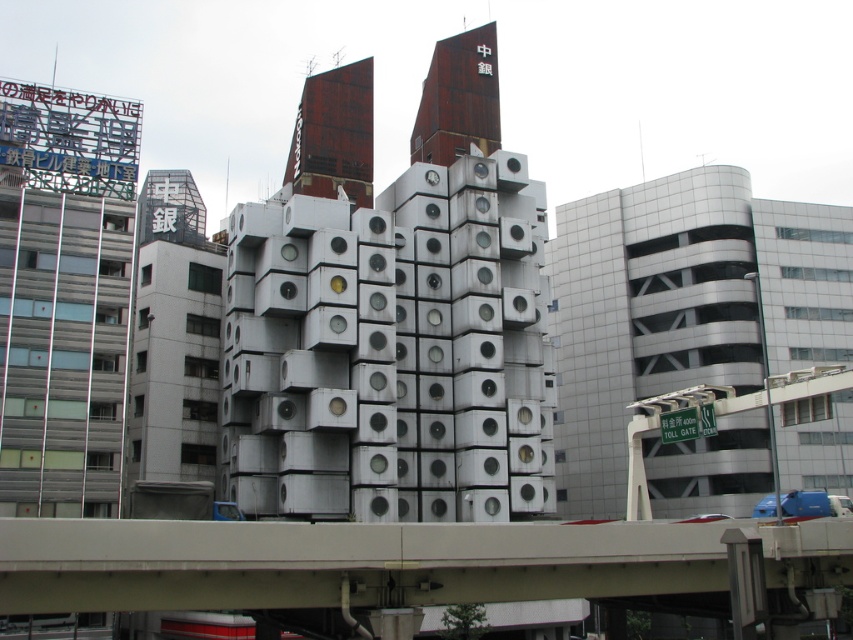
Does point (766, 545) come closer to viewer compared to point (469, 58)?

Yes, point (766, 545) is closer to viewer.

Between point (405, 532) and point (485, 125), which one is positioned behind?

The point (485, 125) is more distant.

At what (x,y) coordinates should I click in order to perform the action: click on concrete bridge at center. Please return your answer as a coordinate pair (x, y). The width and height of the screenshot is (853, 640). Looking at the image, I should click on [346, 563].

Is gray concrete building at left above rusty metal tower at upper center?

No, gray concrete building at left is not above rusty metal tower at upper center.

Can you confirm if gray concrete building at left is shorter than rusty metal tower at upper center?

No, gray concrete building at left is not shorter than rusty metal tower at upper center.

You are a GUI agent. You are given a task and a screenshot of the screen. Output one action in this format:
    pyautogui.click(x=<x>, y=<y>)
    Task: Click on the gray concrete building at left
    The height and width of the screenshot is (640, 853).
    Given the screenshot: What is the action you would take?
    pyautogui.click(x=62, y=296)

Identify the location of gray concrete building at left. This screenshot has height=640, width=853. (62, 296).

Can you confirm if white textured parking garage at right is positioned above gray concrete building at left?

No, white textured parking garage at right is not above gray concrete building at left.

Between white textured parking garage at right and gray concrete building at left, which one appears on the left side from the viewer's perspective?

Positioned to the left is gray concrete building at left.

Is point (834, 225) farther from camera compared to point (96, 259)?

That is True.

Identify the location of white textured parking garage at right. The height and width of the screenshot is (640, 853). (682, 307).